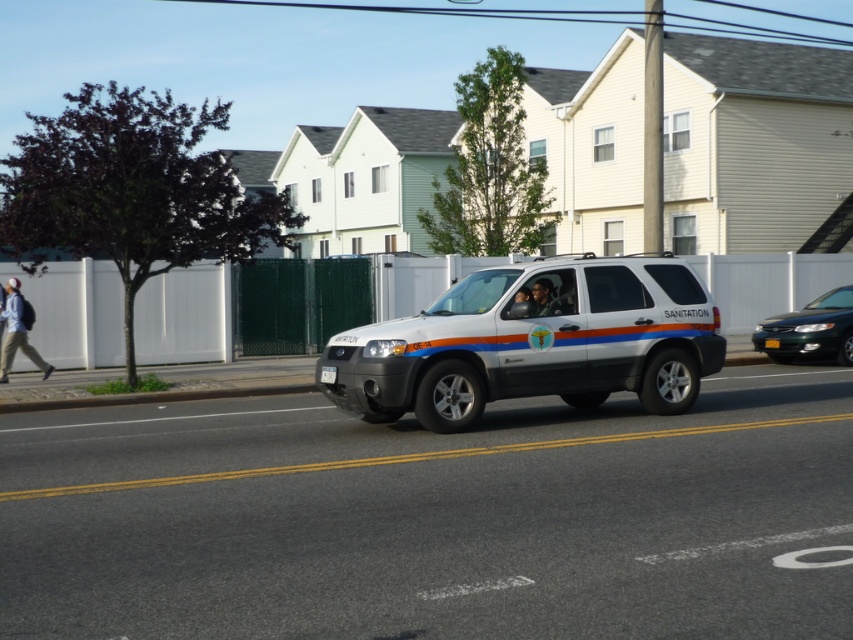
Question: Is metallic green sedan at center below light blue jeans at left?

Choices:
 (A) no
 (B) yes

Answer: (B)

Question: Is white matte suv at center to the right of light blue jeans at left from the viewer's perspective?

Choices:
 (A) yes
 (B) no

Answer: (A)

Question: Can you confirm if white matte suv at center is smaller than metallic green sedan at center?

Choices:
 (A) no
 (B) yes

Answer: (A)

Question: Based on their relative distances, which object is nearer to the metallic green sedan at center?

Choices:
 (A) white matte suv at center
 (B) light blue jeans at left

Answer: (A)

Question: Among these objects, which one is farthest from the camera?

Choices:
 (A) metallic green sedan at center
 (B) white matte suv at center

Answer: (A)

Question: Which object is positioned closest to the metallic green sedan at center?

Choices:
 (A) white matte suv at center
 (B) light blue jeans at left

Answer: (A)